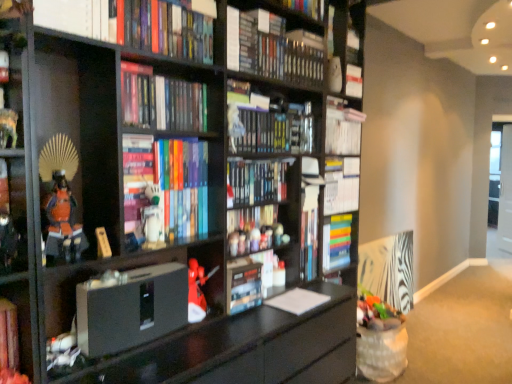
This screenshot has height=384, width=512. What do you see at coordinates (152, 215) in the screenshot?
I see `white matte figurine at center, acting as the 2th toy starting from the left` at bounding box center [152, 215].

Describe the element at coordinates (257, 180) in the screenshot. I see `hardcover book at center, marked as the 6th book in a top-to-bottom arrangement` at that location.

This screenshot has height=384, width=512. Describe the element at coordinates (161, 100) in the screenshot. I see `hardcover books at upper center, the 5th book in the top-to-bottom sequence` at that location.

What do you see at coordinates (133, 25) in the screenshot? This screenshot has height=384, width=512. I see `hardcover book at upper center, placed as the 3th book when sorted from top to bottom` at bounding box center [133, 25].

What are the coordinates of `hardcover book at upper center, the seventh book positioned from the bottom` in the screenshot? It's located at (133, 25).

This screenshot has height=384, width=512. Describe the element at coordinates (337, 242) in the screenshot. I see `multicolored hardcover book at center, the eighth book in the top-to-bottom sequence` at that location.

Find the location of a particular element. white matte figurine at lower left, marked as the 1th toy in a bottom-to-top arrangement is located at coordinates (62, 350).

Between hardcover books at center, the 2th book positioned from the top, and hardcover books at upper center, acting as the fifth book starting from the bottom, which one is positioned behind?

hardcover books at center, the 2th book positioned from the top, is further away from the camera.

Looking at this image, can you tell me how much hardcover books at center, which ranks as the eighth book in bottom-to-top order, and hardcover books at upper center, the 5th book in the top-to-bottom sequence, differ in facing direction?

They differ by 0.877 degrees in their facing directions.

In the scene shown: Is hardcover books at center, the 2th book positioned from the top, not near hardcover books at upper center, the 5th book in the top-to-bottom sequence?

No, hardcover books at center, the 2th book positioned from the top, is not far away from hardcover books at upper center, the 5th book in the top-to-bottom sequence.

Is hardcover books at center, the 2th book positioned from the top, bigger than hardcover books at upper center, the 5th book in the top-to-bottom sequence?

Yes, hardcover books at center, the 2th book positioned from the top, is bigger than hardcover books at upper center, the 5th book in the top-to-bottom sequence.

From a real-world perspective, which is physically below, hardcover books at upper center, acting as the fifth book starting from the bottom, or matte plastic toy at center, which is the 3th toy in top-to-bottom order?

matte plastic toy at center, which is the 3th toy in top-to-bottom order, is physically lower.

Considering the sizes of objects hardcover books at upper center, the 5th book in the top-to-bottom sequence, and matte plastic toy at center, the 4th toy positioned from the bottom, in the image provided, who is bigger, hardcover books at upper center, the 5th book in the top-to-bottom sequence, or matte plastic toy at center, the 4th toy positioned from the bottom,?

With larger size is hardcover books at upper center, the 5th book in the top-to-bottom sequence.

You are a GUI agent. You are given a task and a screenshot of the screen. Output one action in this format:
    pyautogui.click(x=<x>, y=<y>)
    Task: Click on the 4th book in front when counting from the matte plastic toy at center, the 1th toy in the back-to-front sequence
    
    Given the screenshot: What is the action you would take?
    pyautogui.click(x=161, y=100)

In the scene shown: Which of these two, matte gray speaker at center, which ranks as the 1th paperback book in left-to-right order, or hardcover book at center, acting as the fourth book starting from the bottom, stands shorter?

hardcover book at center, acting as the fourth book starting from the bottom, is shorter.

Which point is more distant from viewer, (99, 334) or (228, 174)?

The point (228, 174) is behind.

Is matte gray speaker at center, the 3th paperback book from the right, thinner than hardcover book at center, acting as the fourth book starting from the bottom?

No.

From a real-world perspective, which object stands above the other?

hardcover book at center, acting as the fourth book starting from the bottom, is physically above.

Which object is positioned more to the right, matte plastic toy at center, the 2th toy when ordered from right to left, or matte plastic toy at center, which is the 4th toy from top to bottom?

matte plastic toy at center, the 2th toy when ordered from right to left, is more to the right.

Would you say matte plastic toy at center, the 2th toy when ordered from right to left, contains matte plastic toy at center, which is the 4th toy from top to bottom?

Definitely not — matte plastic toy at center, which is the 4th toy from top to bottom, is not inside matte plastic toy at center, the 2th toy when ordered from right to left.

Is matte plastic toy at center, which is the 2th toy in back-to-front order, taller than matte plastic toy at center, the 3th toy positioned from the right?

No, matte plastic toy at center, which is the 2th toy in back-to-front order, is not taller than matte plastic toy at center, the 3th toy positioned from the right.

From a real-world perspective, is matte plastic toy at center, which is the 2th toy in back-to-front order, physically located above or below matte plastic toy at center, which is the 4th toy in front-to-back order?

In terms of real-world spatial position, matte plastic toy at center, which is the 2th toy in back-to-front order, is above matte plastic toy at center, which is the 4th toy in front-to-back order.

Which object is thinner, matte plastic toy at center, which is the 2th toy in back-to-front order, or hardcover book at center, acting as the fourth book starting from the bottom?

matte plastic toy at center, which is the 2th toy in back-to-front order.

Looking at this image, which object is further away from the camera taking this photo, matte plastic toy at center, the 2th toy when ordered from right to left, or hardcover book at center, marked as the 6th book in a top-to-bottom arrangement?

matte plastic toy at center, the 2th toy when ordered from right to left.

Can we say matte plastic toy at center, which is the 2th toy in back-to-front order, lies outside hardcover book at center, acting as the fourth book starting from the bottom?

Yes, matte plastic toy at center, which is the 2th toy in back-to-front order, is located beyond the bounds of hardcover book at center, acting as the fourth book starting from the bottom.

From the image's perspective, is matte plastic toy at center, which is the 2th toy in back-to-front order, on hardcover book at center, marked as the 6th book in a top-to-bottom arrangement?

No.

Which object is further away from the camera taking this photo, white matte figurine at lower left, the first toy from the left, or matte black samurai armor at left, which is the 2th shelf from top to bottom?

Positioned behind is white matte figurine at lower left, the first toy from the left.

Considering the sizes of objects white matte figurine at lower left, the first toy from the left, and matte black samurai armor at left, which ranks as the 1th shelf in bottom-to-top order, in the image provided, who is bigger, white matte figurine at lower left, the first toy from the left, or matte black samurai armor at left, which ranks as the 1th shelf in bottom-to-top order,?

With larger size is matte black samurai armor at left, which ranks as the 1th shelf in bottom-to-top order.

Can matte black samurai armor at left, which is the 2th shelf from top to bottom, be found inside white matte figurine at lower left, the first toy from the left?

Definitely not — matte black samurai armor at left, which is the 2th shelf from top to bottom, is not inside white matte figurine at lower left, the first toy from the left.

Considering the positions of objects white matte figurine at lower left, the first toy from the left, and matte black samurai armor at left, which ranks as the 1th shelf in bottom-to-top order, in the image provided, who is more to the right, white matte figurine at lower left, the first toy from the left, or matte black samurai armor at left, which ranks as the 1th shelf in bottom-to-top order,?

Positioned to the right is white matte figurine at lower left, the first toy from the left.

Can you tell me how much white paper at center, marked as the 1th paperback book in a right-to-left arrangement, and hardcover book at center, which is the 2th paperback book from left to right, differ in facing direction?

There is a 0.000367-degree angle between the facing directions of white paper at center, marked as the 1th paperback book in a right-to-left arrangement, and hardcover book at center, which is the 2th paperback book from left to right.

From the image's perspective, is white paper at center, marked as the third paperback book in a left-to-right arrangement, beneath hardcover book at center, positioned as the 2th paperback book in right-to-left order?

Indeed, from the image's perspective, white paper at center, marked as the third paperback book in a left-to-right arrangement, is shown beneath hardcover book at center, positioned as the 2th paperback book in right-to-left order.

Could you measure the distance between white paper at center, marked as the third paperback book in a left-to-right arrangement, and hardcover book at center, which is the 2th paperback book from left to right?

white paper at center, marked as the third paperback book in a left-to-right arrangement, and hardcover book at center, which is the 2th paperback book from left to right, are 24.45 centimeters apart.

Is white paper at center, marked as the third paperback book in a left-to-right arrangement, facing towards hardcover book at center, positioned as the 2th paperback book in right-to-left order?

No, white paper at center, marked as the third paperback book in a left-to-right arrangement, does not turn towards hardcover book at center, positioned as the 2th paperback book in right-to-left order.

Find the location of `book that is the 3rd one when counting backward from the hardcover books at upper center, the 5th book in the top-to-bottom sequence`. book that is the 3rd one when counting backward from the hardcover books at upper center, the 5th book in the top-to-bottom sequence is located at coordinates (272, 54).

From the image's perspective, count 3rd books upward from the matte plastic toy at center, the 4th toy positioned from the bottom, and point to it. Please provide its 2D coordinates.

[(161, 100)]

Which object lies nearer to the anchor point matte plastic toy at center, positioned as the 5th toy in bottom-to-top order, hardcover books at upper center, the 5th book in the top-to-bottom sequence, or white matte figurine at lower left, the first toy from the left?

hardcover books at upper center, the 5th book in the top-to-bottom sequence, lies closer to matte plastic toy at center, positioned as the 5th toy in bottom-to-top order, than the other object.

Based on the photo, estimate the real-world distances between objects in this image. Which object is further from hardcover books at center, which ranks as the eighth book in bottom-to-top order, matte plastic toy at center, which is the 5th toy from top to bottom, or multicolored hardcover book at center, the eighth book in the top-to-bottom sequence?

multicolored hardcover book at center, the eighth book in the top-to-bottom sequence, is further to hardcover books at center, which ranks as the eighth book in bottom-to-top order.

When comparing their distances from multicolored hardcover book at center, the eighth book in the top-to-bottom sequence, does white matte figurine at lower left, which is counted as the first toy, starting from the front, or matte plastic toy at center, the 2th toy when ordered from right to left, seem closer?

Among the two, matte plastic toy at center, the 2th toy when ordered from right to left, is located nearer to multicolored hardcover book at center, the eighth book in the top-to-bottom sequence.

When comparing their distances from hardcover book at upper left, which is the 6th book from bottom to top, does white matte figurine at lower left, the sixth toy viewed from the top, or matte gray speaker at center, the 3th paperback book from the right, seem closer?

matte gray speaker at center, the 3th paperback book from the right, is positioned closer to the anchor hardcover book at upper left, which is the 6th book from bottom to top.

From the image, which object appears to be farther from hardcover book at upper left, the 4th book viewed from the top, matte plastic toy at center, positioned as the 5th toy in bottom-to-top order, or hardcover books at center, which ranks as the eighth book in bottom-to-top order?

matte plastic toy at center, positioned as the 5th toy in bottom-to-top order.

Considering their positions, is matte gray speaker at center, which ranks as the 1th paperback book in left-to-right order, positioned closer to white matte figurine at center, arranged as the 1th toy when viewed from the top, than multicolored hardcover book at center, the eighth book in the top-to-bottom sequence?

The object closer to white matte figurine at center, arranged as the 1th toy when viewed from the top, is matte gray speaker at center, which ranks as the 1th paperback book in left-to-right order.

From the image, which object appears to be farther from hardcover book at upper left, the 4th book viewed from the top, white paper at center, marked as the 1th paperback book in a right-to-left arrangement, or hardcover books at center, the 2th book positioned from the top?

Based on the image, white paper at center, marked as the 1th paperback book in a right-to-left arrangement, appears to be further to hardcover book at upper left, the 4th book viewed from the top.

When comparing their distances from matte plastic toy at center, the 2th toy when ordered from right to left, does white matte figurine at lower left, which is counted as the first toy, starting from the front, or hardcover book at upper center, the seventh book positioned from the bottom, seem closer?

Among the two, white matte figurine at lower left, which is counted as the first toy, starting from the front, is located nearer to matte plastic toy at center, the 2th toy when ordered from right to left.

Image resolution: width=512 pixels, height=384 pixels. What are the coordinates of `toy between matte plastic toy at center, which ranks as the fifth toy in front-to-back order, and multicolored hardcover book at center, the eighth book in the top-to-bottom sequence, from front to back` in the screenshot? It's located at (280, 235).

The width and height of the screenshot is (512, 384). Identify the location of paperback book between hardcover book at center, acting as the fourth book starting from the bottom, and multicolored hardcover book at center, which ranks as the second book in bottom-to-top order, from front to back. (297, 301).

Identify the location of paperback book between white matte figurine at center, acting as the 5th toy starting from the back, and hardcover book at center, which is counted as the 7th book, starting from the top, in the front-back direction. (243, 285).

The width and height of the screenshot is (512, 384). In order to click on toy between matte black book at lower left, the 1th book when ordered from bottom to top, and matte gray speaker at center, the 3th paperback book from the right, in the front-back direction in this screenshot , I will do `click(62, 350)`.